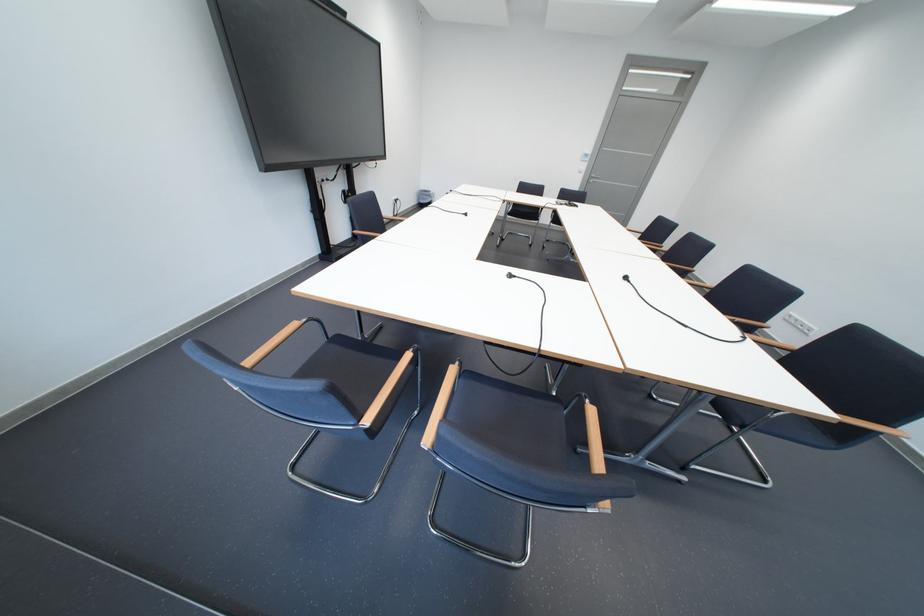
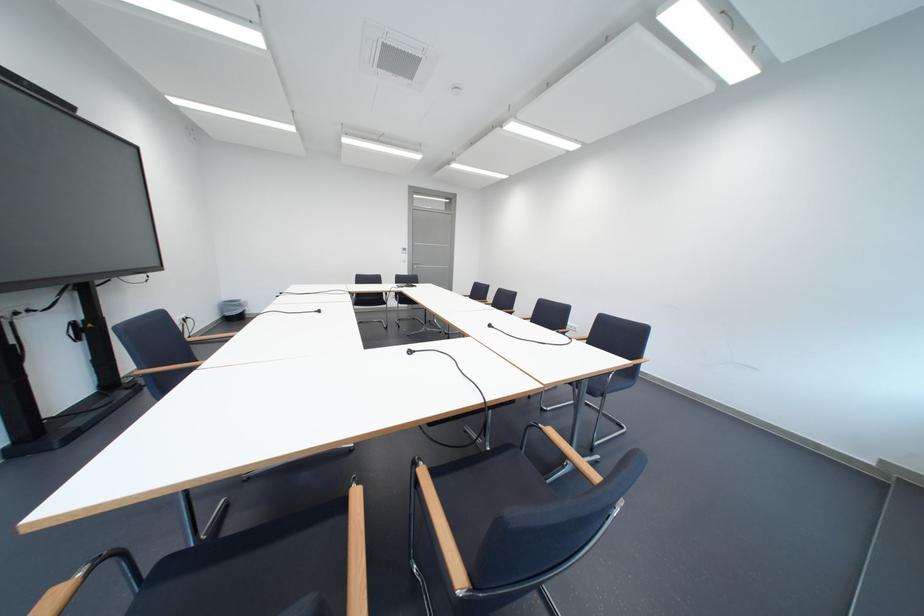
Where in the second image is the point corresponding to (410,359) from the first image?

(355, 508)